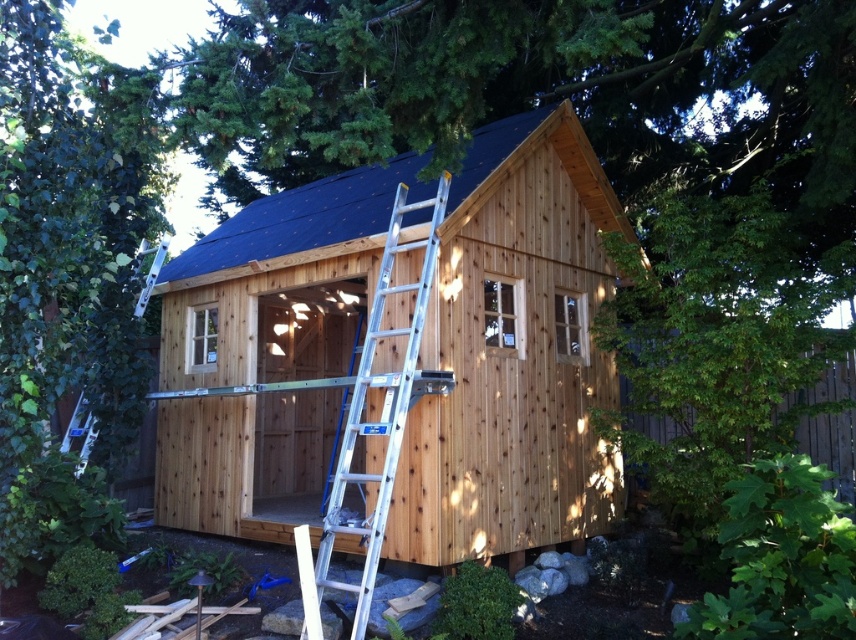
You are a painter who needs to paint the natural wood cabin at center and the silver metallic ladder at center. Which object requires more area to be painted?

The silver metallic ladder at center requires more area to be painted because it occupies more space than the natural wood cabin at center according to the description.

You are a painter standing on the ground near the shed. You need to paint the dark blue shingles at upper center but there is a white metallic ladder at upper left in the way. Can you paint the shingles without moving the ladder?

The dark blue shingles at upper center is in front of the white metallic ladder at upper left, so you can paint the shingles without moving the ladder because they are not blocked by it.